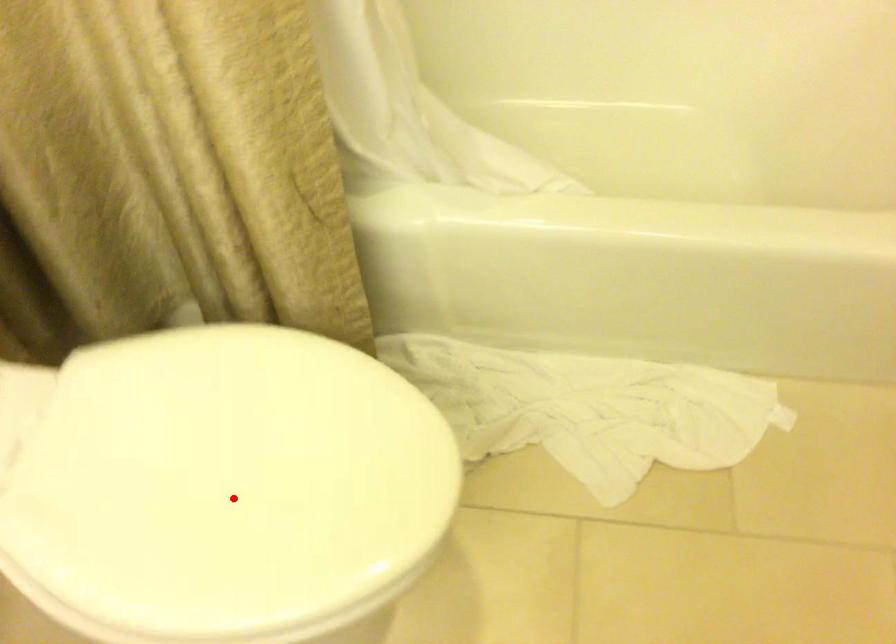
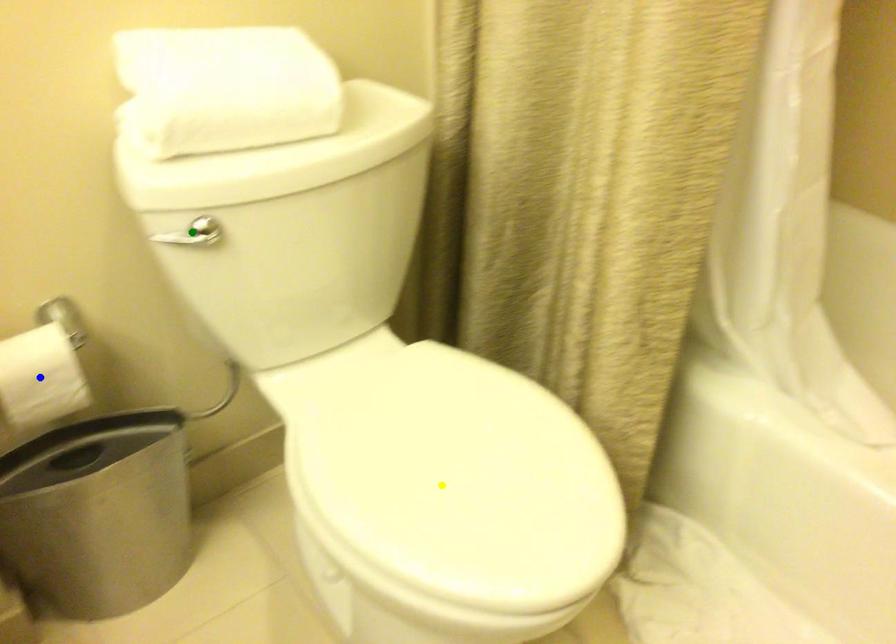
Question: I am providing you with two images of the same scene from different viewpoints. A red point is marked on the first image. You are given multiple points on the second image. Which point in image 2 is actually the same real-world point as the red point in image 1?

Choices:
 (A) blue point
 (B) yellow point
 (C) green point

Answer: (B)